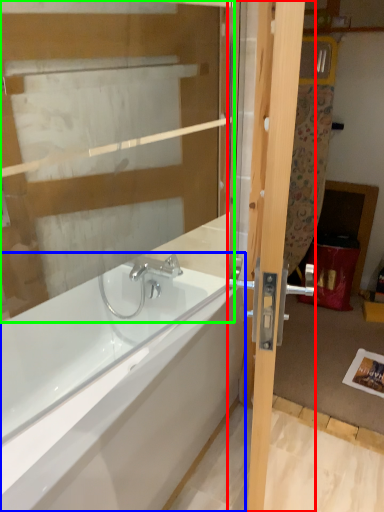
Question: Which is farther away from door (highlighted by a red box)? bathtub (highlighted by a blue box) or glass door (highlighted by a green box)?

Choices:
 (A) bathtub
 (B) glass door

Answer: (A)